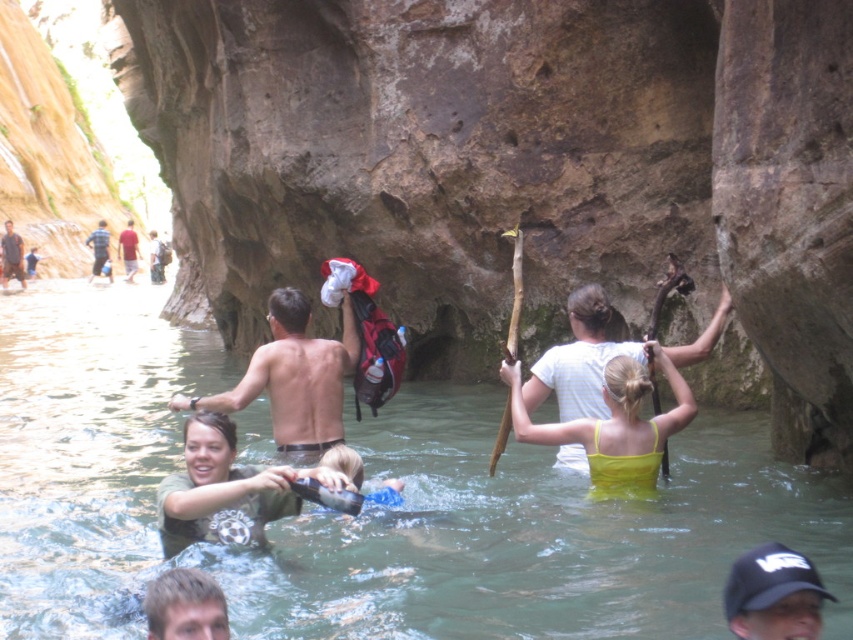
Question: Which object is farther from the camera taking this photo?

Choices:
 (A) dark gray shirt at upper left
 (B) green translucent water at center
 (C) black cap at lower right
 (D) red shirt at center

Answer: (D)

Question: Is yellow matte tank top at center below light brown leather backpack at center?

Choices:
 (A) yes
 (B) no

Answer: (A)

Question: Which of the following is the farthest from the observer?

Choices:
 (A) yellow matte tank top at center
 (B) green matte shirt at center

Answer: (A)

Question: Is green translucent water at center to the left of yellow matte tank top at center from the viewer's perspective?

Choices:
 (A) no
 (B) yes

Answer: (B)

Question: Which of the following is the farthest from the observer?

Choices:
 (A) (204, 499)
 (B) (318, 394)
 (C) (293, 604)
 (D) (157, 243)

Answer: (D)

Question: Is the position of shiny metallic backpack at center more distant than that of striped shirt at left?

Choices:
 (A) no
 (B) yes

Answer: (A)